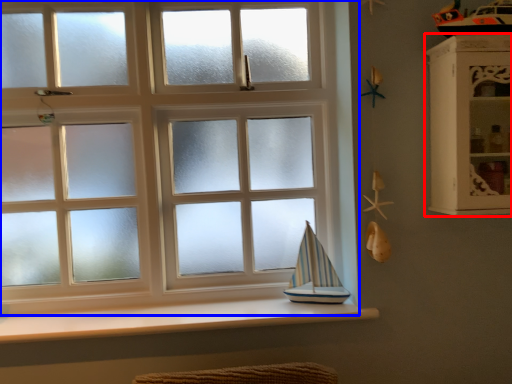
Question: Which of the following is the closest to the observer, shelf (highlighted by a red box) or window (highlighted by a blue box)?

Choices:
 (A) shelf
 (B) window

Answer: (A)